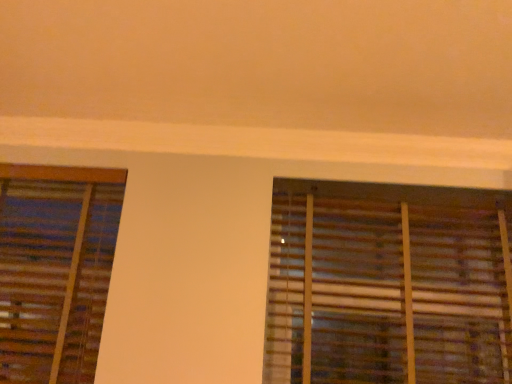
What do you see at coordinates (388, 285) in the screenshot?
I see `wooden blinds at right` at bounding box center [388, 285].

In the scene shown: Measure the distance between point (505, 248) and camera.

The distance of point (505, 248) from camera is 5.66 feet.

At what (x,y) coordinates should I click in order to perform the action: click on wooden blinds at right. Please return your answer as a coordinate pair (x, y). Looking at the image, I should click on (388, 285).

You are a GUI agent. You are given a task and a screenshot of the screen. Output one action in this format:
    pyautogui.click(x=<x>, y=<y>)
    Task: Click on the wooden blinds at right
    This screenshot has width=512, height=384.
    Given the screenshot: What is the action you would take?
    pyautogui.click(x=388, y=285)